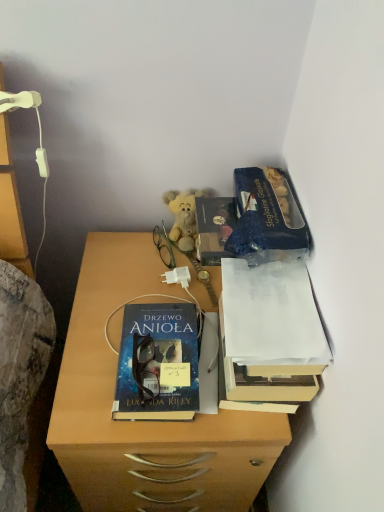
Question: Considering the relative positions of soft yellow plush at center and white paper at upper right, acting as the 2th book starting from the left, in the image provided, is soft yellow plush at center to the left or to the right of white paper at upper right, acting as the 2th book starting from the left,?

Choices:
 (A) left
 (B) right

Answer: (A)

Question: Considering the positions of soft yellow plush at center and white paper at upper right, which ranks as the 1th book in right-to-left order, in the image, is soft yellow plush at center bigger or smaller than white paper at upper right, which ranks as the 1th book in right-to-left order,?

Choices:
 (A) big
 (B) small

Answer: (B)

Question: Estimate the real-world distances between objects in this image. Which object is farther from the blue glossy book at center, the first book viewed from the left?

Choices:
 (A) blue matte paper at upper right
 (B) soft yellow plush at center
 (C) green plastic glasses at center
 (D) white paper at upper right, which ranks as the 1th book in right-to-left order
 (E) matte wooden desk at center

Answer: (B)

Question: Estimate the real-world distances between objects in this image. Which object is farther from the matte wooden desk at center?

Choices:
 (A) blue glossy book at center, which is counted as the 2th book, starting from the right
 (B) soft yellow plush at center
 (C) white paper at upper right, acting as the 2th book starting from the left
 (D) blue matte paper at upper right
 (E) green plastic glasses at center

Answer: (B)